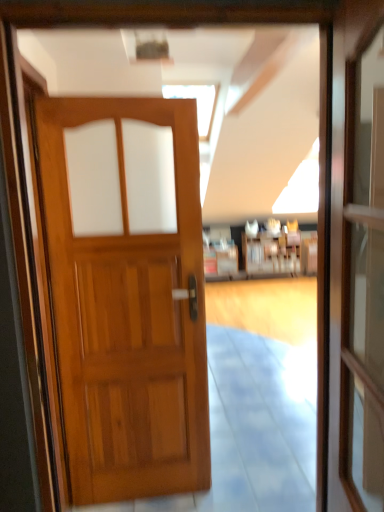
Question: Considering the positions of wooden door at center and transparent glass screen door at right in the image, is wooden door at center wider or thinner than transparent glass screen door at right?

Choices:
 (A) thin
 (B) wide

Answer: (B)

Question: Would you say wooden door at center is to the left or to the right of transparent glass screen door at right in the picture?

Choices:
 (A) left
 (B) right

Answer: (A)

Question: Estimate the real-world distances between objects in this image. Which object is farther from the transparent glass screen door at right?

Choices:
 (A) wooden bookshelf at center
 (B) wooden door at center

Answer: (A)

Question: Estimate the real-world distances between objects in this image. Which object is closer to the wooden bookshelf at center?

Choices:
 (A) transparent glass screen door at right
 (B) wooden door at center

Answer: (B)